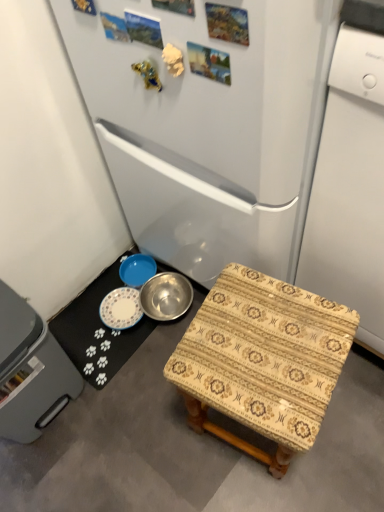
What are the coordinates of `free area in between patterned fabric stool at lower right and gray plastic dishwasher at lower left` in the screenshot? It's located at (143, 430).